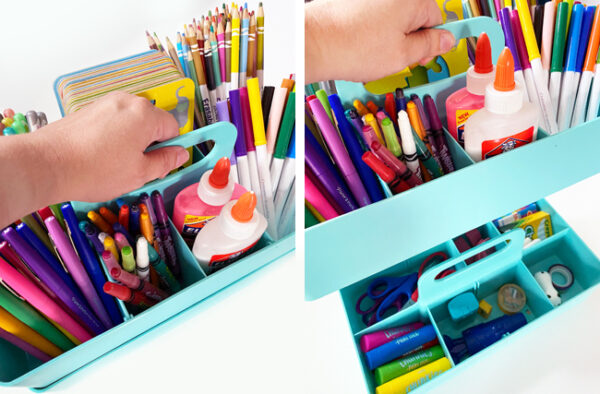
Locate an element on the screen. glue bottle is located at coordinates (451, 108), (202, 199), (219, 239), (478, 144).